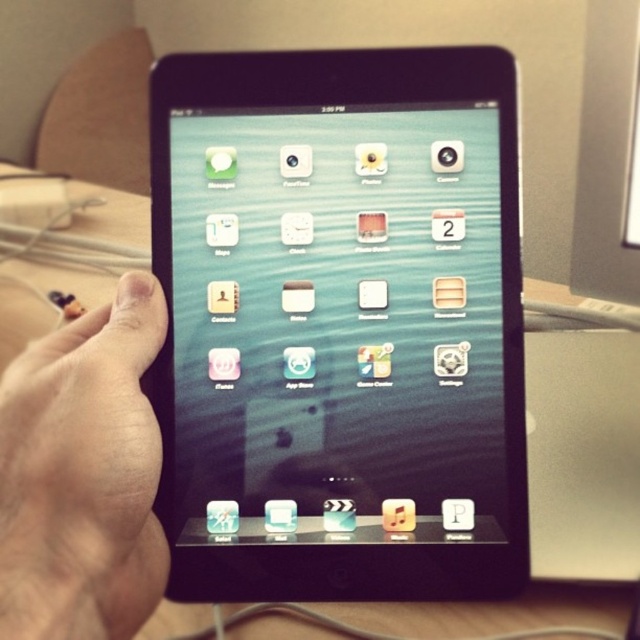
Question: Among these points, which one is nearest to the camera?

Choices:
 (A) (621, 602)
 (B) (380, 371)
 (C) (28, 368)

Answer: (C)

Question: Which point appears farthest from the camera in this image?

Choices:
 (A) (17, 477)
 (B) (340, 300)

Answer: (B)

Question: Does skinny beige hand at lower left appear on the left side of wooden table at center?

Choices:
 (A) no
 (B) yes

Answer: (A)

Question: Which point is closer to the camera?

Choices:
 (A) wooden table at center
 (B) skinny beige hand at lower left

Answer: (B)

Question: Is black glossy tablet at center positioned before wooden table at center?

Choices:
 (A) no
 (B) yes

Answer: (B)

Question: Is the position of black glossy tablet at center more distant than that of skinny beige hand at lower left?

Choices:
 (A) yes
 (B) no

Answer: (A)